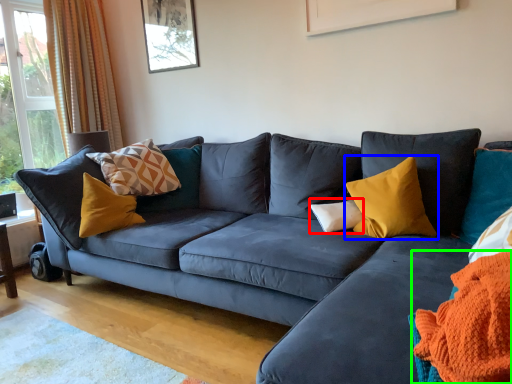
Question: Estimate the real-world distances between objects in this image. Which object is closer to pillow (highlighted by a red box), pillow (highlighted by a blue box) or blanket (highlighted by a green box)?

Choices:
 (A) pillow
 (B) blanket

Answer: (A)